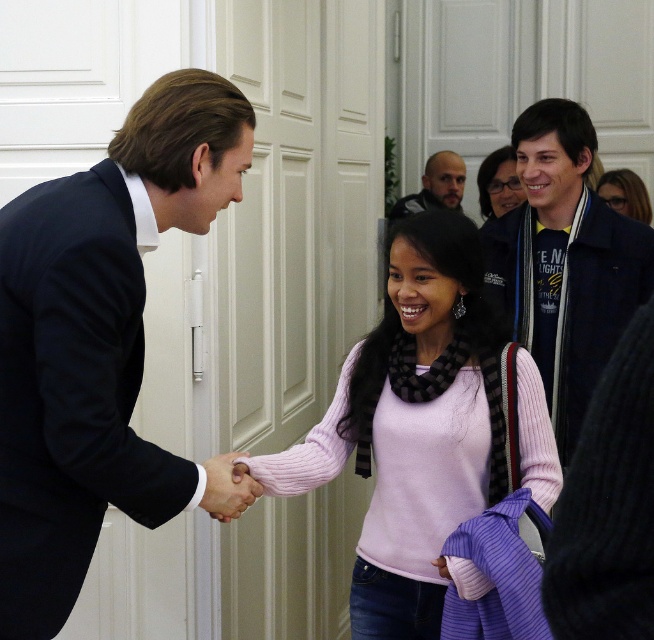
You are standing in the hallway where two people are shaking hands. There are two points marked in the image at coordinates point (485, 182) and point (634, 188). Which point is closer to you?

Point (485, 182) is closer to you because it is further to the camera than point (634, 188).

You are a photographer positioned in the hallway where the handshake is taking place. You need to ensure that both the pink sweater at center and the matte black hair at upper right are clearly visible in your photo. Based on their sizes, which object should you focus on first to ensure proper exposure?

The pink sweater at center has a greater height compared to the matte black hair at upper right, so you should focus on the pink sweater at center first to ensure proper exposure since it is larger and more prominent in the frame.